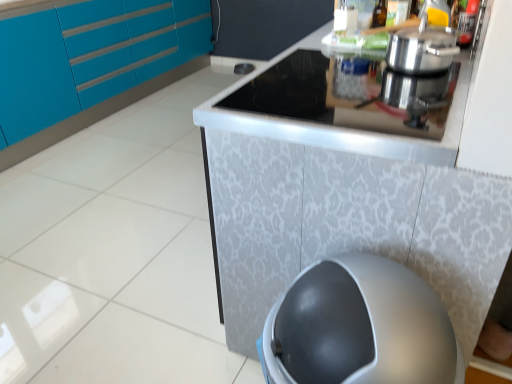
This screenshot has height=384, width=512. What do you see at coordinates (349, 182) in the screenshot? I see `silver textured counter at center` at bounding box center [349, 182].

Find the location of a particular element. black glass cooktop at upper center is located at coordinates (348, 103).

Where is `teal glossy cabinets at upper left`? This screenshot has width=512, height=384. teal glossy cabinets at upper left is located at coordinates (90, 67).

Describe the element at coordinates (90, 67) in the screenshot. Image resolution: width=512 pixels, height=384 pixels. I see `teal glossy cabinets at upper left` at that location.

Identify the location of translucent glass bottle at upper center. The image size is (512, 384). (379, 15).

Who is taller, black glass cooktop at upper center or teal glossy cabinets at upper left?

teal glossy cabinets at upper left.

From the image's perspective, is black glass cooktop at upper center positioned above or below teal glossy cabinets at upper left?

Based on their image positions, black glass cooktop at upper center is located beneath teal glossy cabinets at upper left.

In the image, is black glass cooktop at upper center on the left side or the right side of teal glossy cabinets at upper left?

From the image, it's evident that black glass cooktop at upper center is to the right of teal glossy cabinets at upper left.

Considering the positions of objects black glass cooktop at upper center and silver textured counter at center in the image provided, who is more to the left, black glass cooktop at upper center or silver textured counter at center?

black glass cooktop at upper center.

Looking at this image, from the image's perspective, is black glass cooktop at upper center over silver textured counter at center?

Indeed, from the image's perspective, black glass cooktop at upper center is shown above silver textured counter at center.

Is silver textured counter at center located within black glass cooktop at upper center?

No, silver textured counter at center is located outside of black glass cooktop at upper center.

Between black glass cooktop at upper center and silver textured counter at center, which one is positioned behind?

black glass cooktop at upper center is behind.

Which is closer to the camera, (400, 249) or (450, 145)?

Point (400, 249) appears to be farther away from the viewer than point (450, 145).

Considering the relative sizes of silver textured counter at center and black glass cooktop at upper center in the image provided, is silver textured counter at center bigger than black glass cooktop at upper center?

Yes.

Can you confirm if silver textured counter at center is taller than black glass cooktop at upper center?

Indeed, silver textured counter at center has a greater height compared to black glass cooktop at upper center.

From a real-world perspective, is black glass cooktop at upper center positioned above or below translucent glass bottle at upper center?

black glass cooktop at upper center is below translucent glass bottle at upper center.

The height and width of the screenshot is (384, 512). In order to click on counter top below the translucent glass bottle at upper center (from the image's perspective) in this screenshot , I will do `click(348, 103)`.

Considering the positions of point (428, 85) and point (372, 19), is point (428, 85) closer or farther from the camera than point (372, 19)?

Point (428, 85) is positioned closer to the camera compared to point (372, 19).

Considering the sizes of translucent glass bottle at upper center and black glass cooktop at upper center in the image, is translucent glass bottle at upper center bigger or smaller than black glass cooktop at upper center?

translucent glass bottle at upper center is smaller than black glass cooktop at upper center.

Considering the relative positions of translucent glass bottle at upper center and black glass cooktop at upper center in the image provided, is translucent glass bottle at upper center behind black glass cooktop at upper center?

Yes.

From the image's perspective, relative to black glass cooktop at upper center, is translucent glass bottle at upper center above or below?

Based on their image positions, translucent glass bottle at upper center is located above black glass cooktop at upper center.

This screenshot has height=384, width=512. Find the location of `bottle above the black glass cooktop at upper center (from the image's perspective)`. bottle above the black glass cooktop at upper center (from the image's perspective) is located at coordinates (379, 15).

Image resolution: width=512 pixels, height=384 pixels. In order to click on cabinetry located behind the silver textured counter at center in this screenshot , I will do `click(90, 67)`.

Which object is thinner, teal glossy cabinets at upper left or silver textured counter at center?

silver textured counter at center.

Is teal glossy cabinets at upper left inside or outside of silver textured counter at center?

teal glossy cabinets at upper left is not enclosed by silver textured counter at center.

Does teal glossy cabinets at upper left turn towards silver textured counter at center?

Yes, teal glossy cabinets at upper left is oriented towards silver textured counter at center.

Does translucent glass bottle at upper center have a greater height compared to silver textured counter at center?

No.

Is point (377, 24) positioned behind point (317, 197)?

That is True.

From a real-world perspective, is translucent glass bottle at upper center above or below silver textured counter at center?

From a real-world perspective, translucent glass bottle at upper center is physically above silver textured counter at center.

Measure the distance from translucent glass bottle at upper center to silver textured counter at center.

They are 30.07 inches apart.

The image size is (512, 384). What are the coordinates of `cabinetry below the black glass cooktop at upper center (from a real-world perspective)` in the screenshot? It's located at pos(90,67).

Where is `counter top lying on the left of silver textured counter at center`? The height and width of the screenshot is (384, 512). counter top lying on the left of silver textured counter at center is located at coordinates (348, 103).

Looking at the image, which one is located further to translucent glass bottle at upper center, teal glossy cabinets at upper left or silver textured counter at center?

teal glossy cabinets at upper left.

Based on their spatial positions, is silver textured counter at center or translucent glass bottle at upper center further from teal glossy cabinets at upper left?

Based on the image, translucent glass bottle at upper center appears to be further to teal glossy cabinets at upper left.

Looking at the image, which one is located closer to translucent glass bottle at upper center, black glass cooktop at upper center or teal glossy cabinets at upper left?

black glass cooktop at upper center lies closer to translucent glass bottle at upper center than the other object.

Considering their positions, is translucent glass bottle at upper center positioned closer to teal glossy cabinets at upper left than silver textured counter at center?

silver textured counter at center lies closer to teal glossy cabinets at upper left than the other object.

Looking at this image, when comparing their distances from silver textured counter at center, does teal glossy cabinets at upper left or translucent glass bottle at upper center seem further?

teal glossy cabinets at upper left lies further to silver textured counter at center than the other object.

From the picture: Looking at the image, which one is located further to teal glossy cabinets at upper left, translucent glass bottle at upper center or black glass cooktop at upper center?

The object further to teal glossy cabinets at upper left is translucent glass bottle at upper center.

From the image, which object appears to be nearer to translucent glass bottle at upper center, teal glossy cabinets at upper left or black glass cooktop at upper center?

Based on the image, black glass cooktop at upper center appears to be nearer to translucent glass bottle at upper center.

Estimate the real-world distances between objects in this image. Which object is closer to translucent glass bottle at upper center, silver textured counter at center or teal glossy cabinets at upper left?

Based on the image, silver textured counter at center appears to be nearer to translucent glass bottle at upper center.

At what (x,y) coordinates should I click in order to perform the action: click on counter top between silver textured counter at center and translucent glass bottle at upper center in the front-back direction. Please return your answer as a coordinate pair (x, y). Looking at the image, I should click on (348, 103).

I want to click on counter top between teal glossy cabinets at upper left and translucent glass bottle at upper center, so click(x=348, y=103).

Find the location of `counter top located between teal glossy cabinets at upper left and silver textured counter at center in the left-right direction`. counter top located between teal glossy cabinets at upper left and silver textured counter at center in the left-right direction is located at coordinates (348, 103).

Locate an element on the screen. counter between teal glossy cabinets at upper left and translucent glass bottle at upper center from left to right is located at coordinates (349, 182).